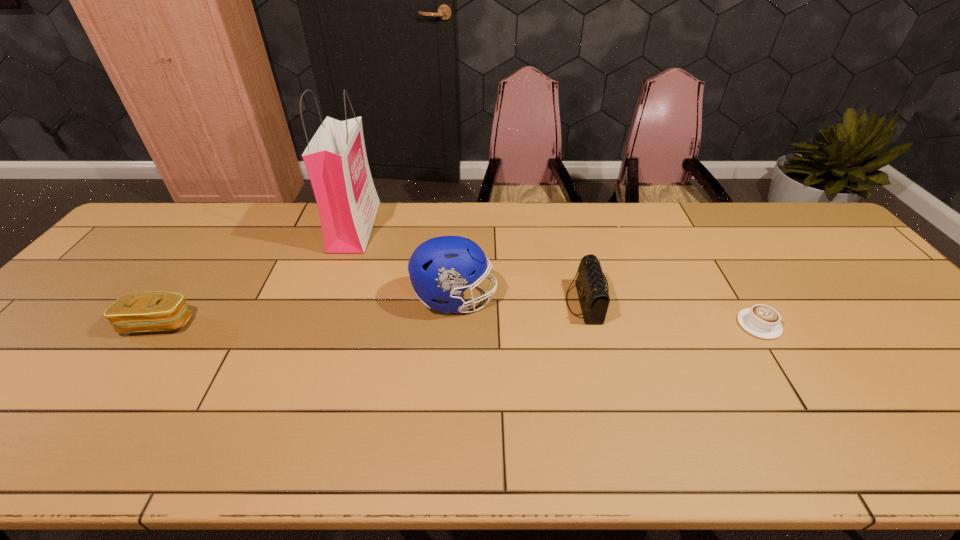
Where is `free area in between the farthest object and the cappuccino`? The width and height of the screenshot is (960, 540). free area in between the farthest object and the cappuccino is located at coordinates (557, 275).

I want to click on the second closest object relative to the shorter clutch bag, so click(x=442, y=268).

Locate which object is the closest to the third shortest object. Please provide its 2D coordinates. Your answer should be formatted as a tuple, i.e. [(x, y)], where the tuple contains the x and y coordinates of a point satisfying the conditions above.

[(442, 268)]

Identify the location of vacant region that satisfies the following two spatial constraints: 1. on the front-facing side of the farthest object; 2. on the zipper side of the fourth tallest object. The width and height of the screenshot is (960, 540). (319, 324).

At what (x,y) coordinates should I click in order to perform the action: click on free space that satisfies the following two spatial constraints: 1. on the face guard of the football helmet; 2. on the zipper side of the shorter clutch bag. Please return your answer as a coordinate pair (x, y). The height and width of the screenshot is (540, 960). Looking at the image, I should click on (453, 324).

Find the location of `free point that satisfies the following two spatial constraints: 1. on the face guard of the third object from right to left; 2. on the zipper side of the second shortest object`. free point that satisfies the following two spatial constraints: 1. on the face guard of the third object from right to left; 2. on the zipper side of the second shortest object is located at coordinates (453, 324).

Locate an element on the screen. blank area in the image that satisfies the following two spatial constraints: 1. on the face guard of the second tallest object; 2. on the zipper side of the shorter clutch bag is located at coordinates (453, 324).

Locate an element on the screen. The height and width of the screenshot is (540, 960). free space that satisfies the following two spatial constraints: 1. on the face guard of the fourth shortest object; 2. on the zipper side of the second shortest object is located at coordinates (453, 324).